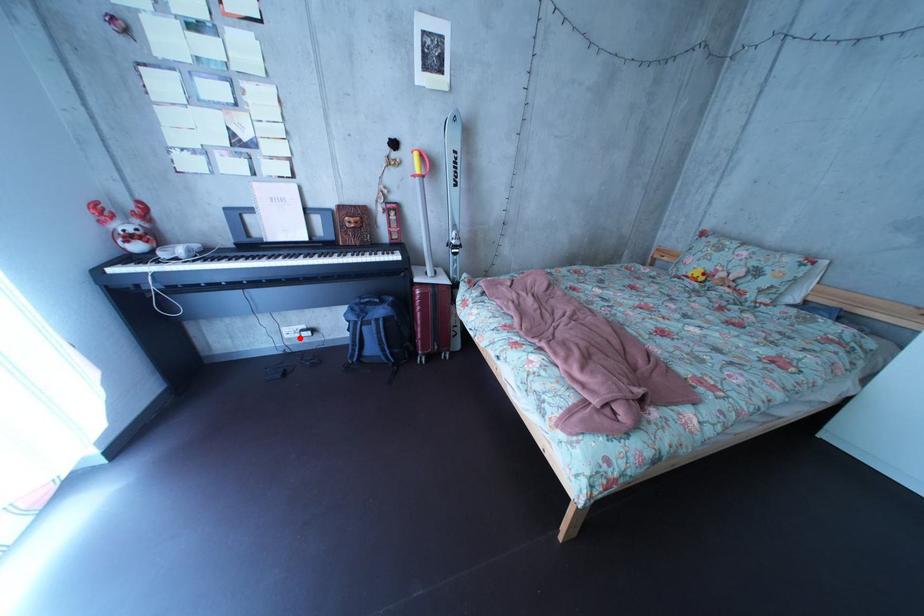
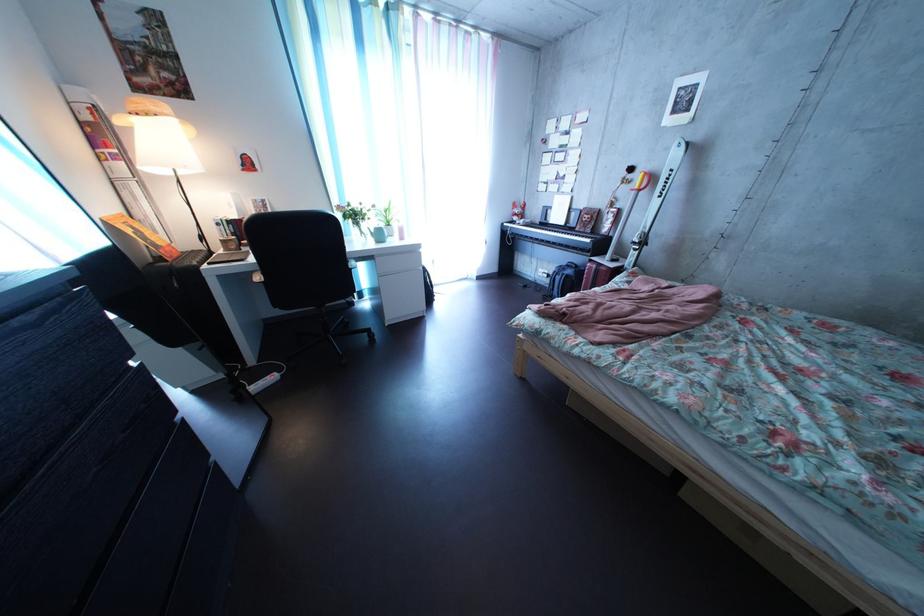
Where in the second image is the point corresponding to the highlighted location from the first image?

(554, 278)